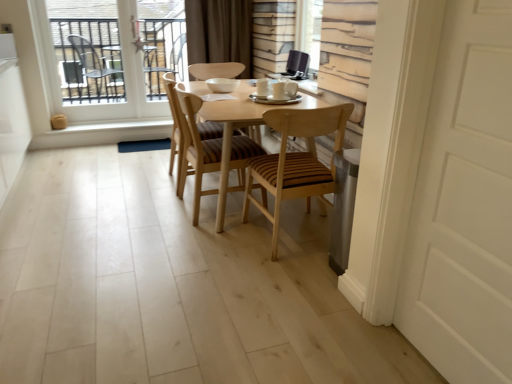
Question: Is clear glass window at upper left facing away from woodenchair at center, the 2th chair from the right?

Choices:
 (A) no
 (B) yes

Answer: (A)

Question: Can you confirm if clear glass window at upper left is positioned to the left of woodenchair at center, the 2th chair from the right?

Choices:
 (A) no
 (B) yes

Answer: (B)

Question: Does clear glass window at upper left have a lesser height compared to woodenchair at center, the 2th chair from the right?

Choices:
 (A) no
 (B) yes

Answer: (A)

Question: Is clear glass window at upper left beside woodenchair at center, placed as the 2th chair when sorted from left to right?

Choices:
 (A) yes
 (B) no

Answer: (B)

Question: Is clear glass window at upper left positioned beyond the bounds of woodenchair at center, the 2th chair from the right?

Choices:
 (A) yes
 (B) no

Answer: (A)

Question: In the image, is woodenchair at center, the 2th chair from the right, positioned in front of or behind wooden at center, which is the 3th chair in right-to-left order?

Choices:
 (A) behind
 (B) front

Answer: (B)

Question: Considering the positions of woodenchair at center, the 2th chair from the right, and wooden at center, which is the 3th chair in right-to-left order, in the image, is woodenchair at center, the 2th chair from the right, taller or shorter than wooden at center, which is the 3th chair in right-to-left order,?

Choices:
 (A) tall
 (B) short

Answer: (A)

Question: Is woodenchair at center, the 2th chair from the right, inside or outside of wooden at center, which is the 1th chair from left to right?

Choices:
 (A) inside
 (B) outside

Answer: (B)

Question: From a real-world perspective, is woodenchair at center, placed as the 2th chair when sorted from left to right, positioned above or below wooden at center, which is the 3th chair in right-to-left order?

Choices:
 (A) above
 (B) below

Answer: (A)

Question: Considering their positions, is wooden striped chair at center, marked as the third chair in a left-to-right arrangement, located in front of or behind brown fabric curtain at upper center?

Choices:
 (A) front
 (B) behind

Answer: (A)

Question: Looking at their shapes, would you say wooden striped chair at center, marked as the third chair in a left-to-right arrangement, is wider or thinner than brown fabric curtain at upper center?

Choices:
 (A) thin
 (B) wide

Answer: (B)

Question: From the image's perspective, is wooden striped chair at center, marked as the third chair in a left-to-right arrangement, positioned above or below brown fabric curtain at upper center?

Choices:
 (A) above
 (B) below

Answer: (B)

Question: From a real-world perspective, is wooden striped chair at center, the 1th chair when ordered from right to left, positioned above or below brown fabric curtain at upper center?

Choices:
 (A) below
 (B) above

Answer: (A)

Question: Is wooden striped chair at center, the 1th chair when ordered from right to left, inside the boundaries of wooden slats at upper center, or outside?

Choices:
 (A) inside
 (B) outside

Answer: (B)

Question: From a real-world perspective, is wooden striped chair at center, marked as the third chair in a left-to-right arrangement, above or below wooden slats at upper center?

Choices:
 (A) above
 (B) below

Answer: (B)